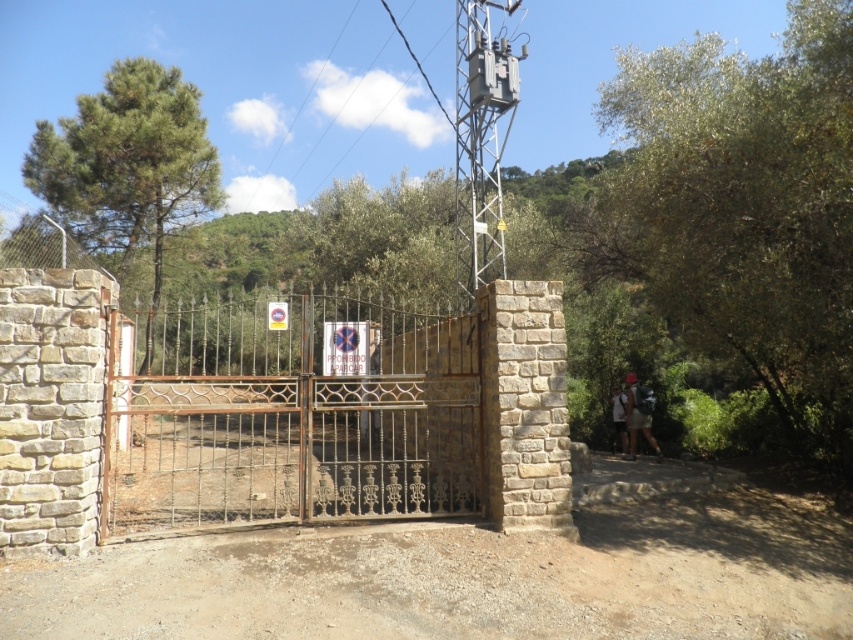
You are standing at the point marked by the coordinates [294,420] in the image. What object are you directly facing?

You are directly facing the rusty metal gate at center, as the point marked by the coordinates [294,420] indicates its location.

You are standing at the stone gate with ornate metalwork and need to walk to a specific location. There are two points marked on the ground in front of you. The first point is at coordinates point (x=686, y=250), and the second point is at coordinates point (x=639, y=426). Which of these two points is closer to you, the observer?

Point (x=686, y=250) is in front of point (x=639, y=426), so it is closer to you as the observer.